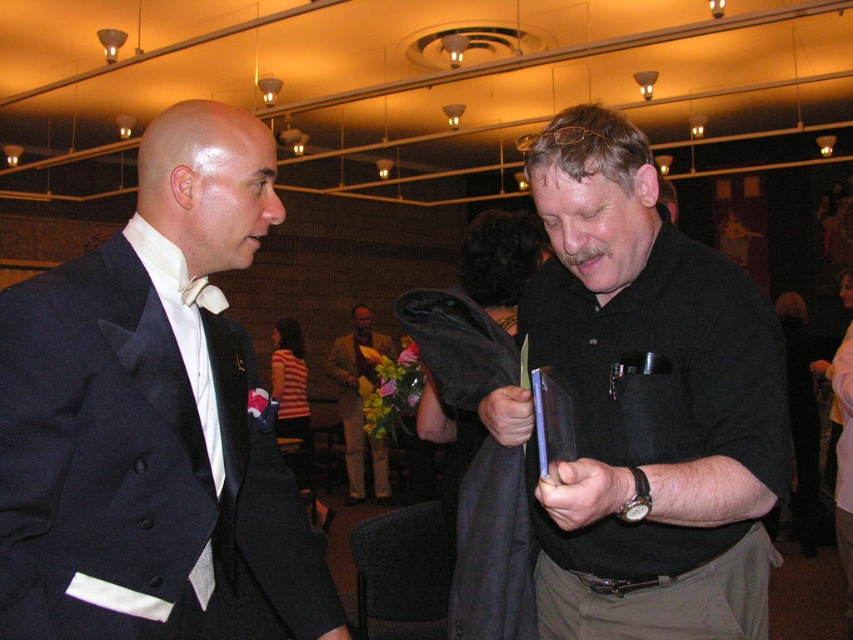
Question: Which object is the closest to the black matte shirt at center?

Choices:
 (A) yellow textured suit at center
 (B) matte black suit at left

Answer: (B)

Question: Is matte black suit at left further to the viewer compared to black matte shirt at center?

Choices:
 (A) no
 (B) yes

Answer: (B)

Question: Estimate the real-world distances between objects in this image. Which object is farther from the matte black suit at left?

Choices:
 (A) black matte shirt at center
 (B) yellow textured suit at center

Answer: (B)

Question: From the image, what is the correct spatial relationship of black matte shirt at center in relation to yellow textured suit at center?

Choices:
 (A) right
 (B) left

Answer: (A)

Question: Is black matte shirt at center further to the viewer compared to yellow textured suit at center?

Choices:
 (A) yes
 (B) no

Answer: (B)

Question: Which object is closer to the camera taking this photo?

Choices:
 (A) black matte shirt at center
 (B) yellow textured suit at center
 (C) matte black suit at left

Answer: (A)